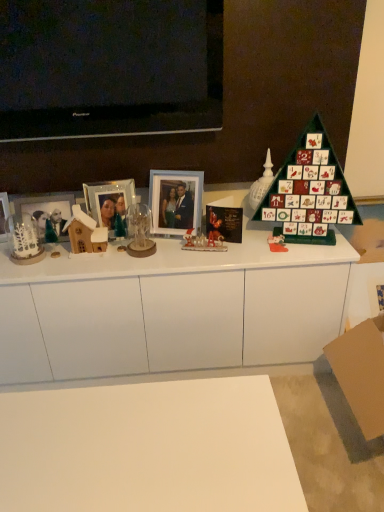
The width and height of the screenshot is (384, 512). In order to click on free region on the left part of black paper christmas card at center in this screenshot , I will do `click(179, 244)`.